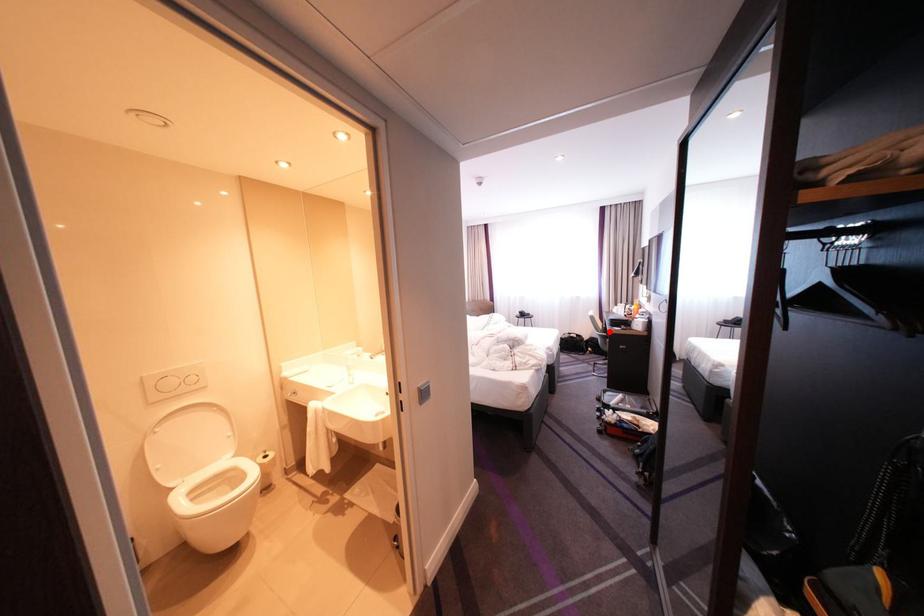
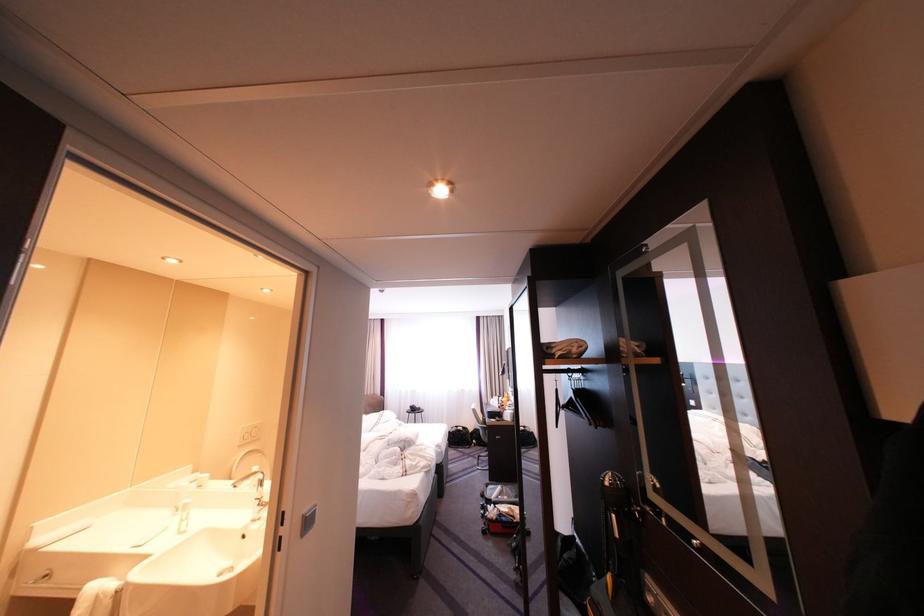
The point at the highlighted location is marked in the first image. Where is the corresponding point in the second image?

(491, 424)